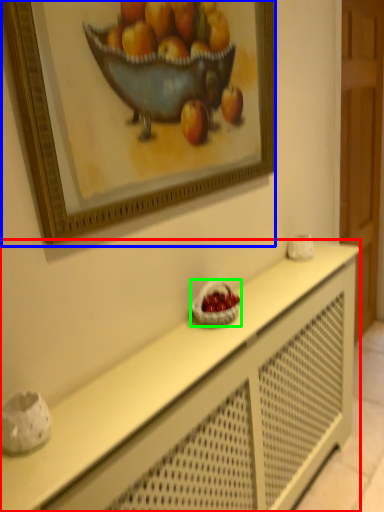
Question: Considering the real-world distances, which object is closest to table (highlighted by a red box)? picture frame (highlighted by a blue box) or basket (highlighted by a green box).

Choices:
 (A) picture frame
 (B) basket

Answer: (B)